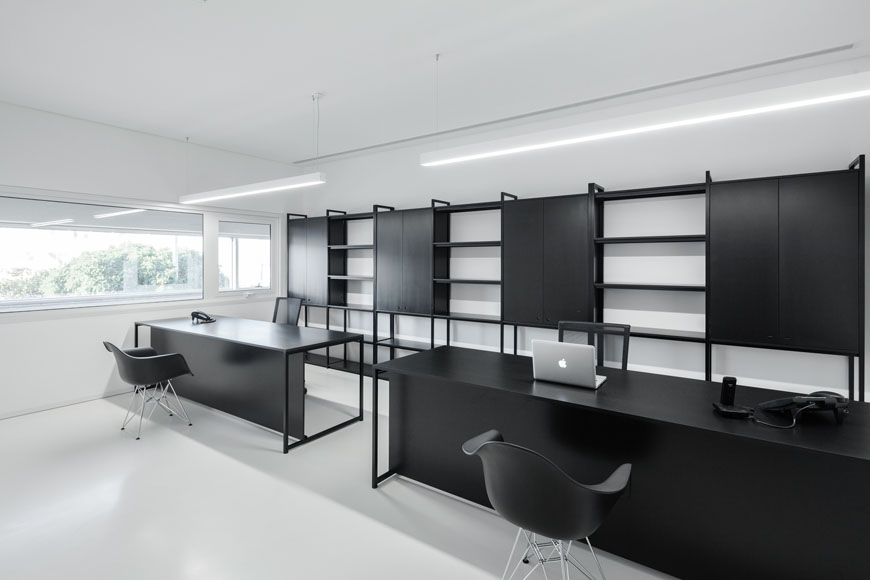
Locate an element on the screen. This screenshot has width=870, height=580. floor is located at coordinates (177, 525).